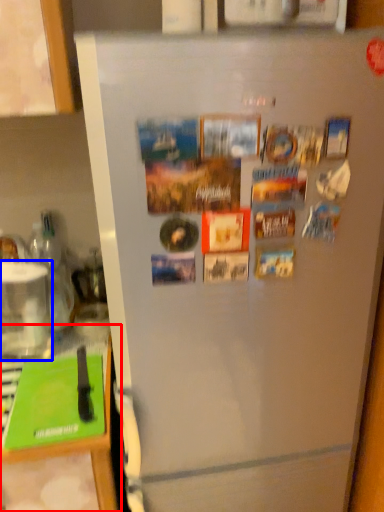
Question: Which point is further to the camera, counter top (highlighted by a red box) or appliance (highlighted by a blue box)?

Choices:
 (A) counter top
 (B) appliance

Answer: (B)